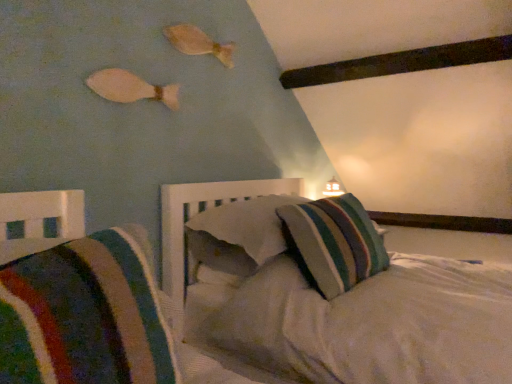
Question: From a real-world perspective, is white matte fish at upper left, which is counted as the first fish, starting from the bottom, below striped fabric pillow at center, which is the second pillow in back-to-front order?

Choices:
 (A) no
 (B) yes

Answer: (A)

Question: Does white matte fish at upper left, the 1th fish in the left-to-right sequence, appear on the right side of striped fabric pillow at center, which is the second pillow in back-to-front order?

Choices:
 (A) yes
 (B) no

Answer: (B)

Question: Considering the relative sizes of white matte fish at upper left, the 2th fish positioned from the right, and striped fabric pillow at center, the second pillow positioned from the front, in the image provided, is white matte fish at upper left, the 2th fish positioned from the right, shorter than striped fabric pillow at center, the second pillow positioned from the front,?

Choices:
 (A) yes
 (B) no

Answer: (A)

Question: Is white matte fish at upper left, which is counted as the 2th fish, starting from the top, far away from striped fabric pillow at center, which is the second pillow in back-to-front order?

Choices:
 (A) yes
 (B) no

Answer: (B)

Question: Does white matte fish at upper left, which is counted as the first fish, starting from the bottom, have a greater height compared to striped fabric pillow at center, the second pillow positioned from the front?

Choices:
 (A) yes
 (B) no

Answer: (B)

Question: Is striped fabric pillow at center, which is the 1th pillow in front-to-back order, bigger or smaller than white matte fish at upper left, which is counted as the first fish, starting from the bottom?

Choices:
 (A) small
 (B) big

Answer: (B)

Question: Choose the correct answer: Is striped fabric pillow at center, which ranks as the third pillow in back-to-front order, inside white matte fish at upper left, which is counted as the second fish, starting from the back, or outside it?

Choices:
 (A) outside
 (B) inside

Answer: (A)

Question: Considering the positions of point (119, 291) and point (131, 100), is point (119, 291) closer or farther from the camera than point (131, 100)?

Choices:
 (A) closer
 (B) farther

Answer: (A)

Question: From the image's perspective, is striped fabric pillow at center, which is the 1th pillow in front-to-back order, positioned above or below white matte fish at upper left, the first fish when ordered from front to back?

Choices:
 (A) below
 (B) above

Answer: (A)

Question: Considering the positions of white matte fish at upper left, the 1th fish in the left-to-right sequence, and striped fabric pillow at center, placed as the first pillow when sorted from back to front, in the image, is white matte fish at upper left, the 1th fish in the left-to-right sequence, taller or shorter than striped fabric pillow at center, placed as the first pillow when sorted from back to front,?

Choices:
 (A) tall
 (B) short

Answer: (B)

Question: Would you say white matte fish at upper left, which is counted as the first fish, starting from the bottom, is inside or outside striped fabric pillow at center, marked as the 3th pillow in a front-to-back arrangement?

Choices:
 (A) outside
 (B) inside

Answer: (A)

Question: From a real-world perspective, is white matte fish at upper left, the 2th fish positioned from the right, above or below striped fabric pillow at center, placed as the first pillow when sorted from back to front?

Choices:
 (A) below
 (B) above

Answer: (B)

Question: Looking at the image, does white matte fish at upper left, which is counted as the first fish, starting from the bottom, seem bigger or smaller compared to striped fabric pillow at center, placed as the first pillow when sorted from back to front?

Choices:
 (A) big
 (B) small

Answer: (B)

Question: In terms of width, does striped fabric pillow at center, which is the second pillow in back-to-front order, look wider or thinner when compared to wooden fish at upper center, placed as the first fish when sorted from back to front?

Choices:
 (A) thin
 (B) wide

Answer: (B)

Question: From their relative heights in the image, would you say striped fabric pillow at center, which is the second pillow in back-to-front order, is taller or shorter than wooden fish at upper center, the 2th fish in the bottom-to-top sequence?

Choices:
 (A) tall
 (B) short

Answer: (A)